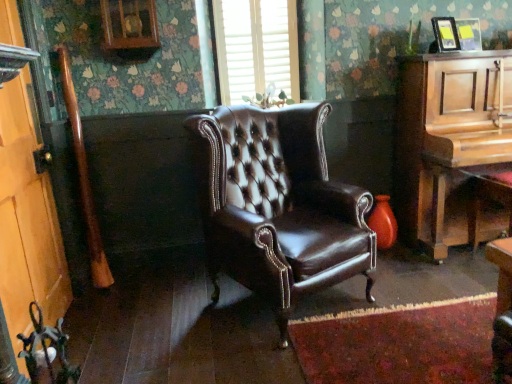
Question: Considering the positions of wooden door at left and wooden piano at right in the image, is wooden door at left wider or thinner than wooden piano at right?

Choices:
 (A) thin
 (B) wide

Answer: (A)

Question: From the image's perspective, relative to wooden piano at right, is wooden door at left above or below?

Choices:
 (A) above
 (B) below

Answer: (B)

Question: Estimate the real-world distances between objects in this image. Which object is closer to the white textured blinds at upper center?

Choices:
 (A) wooden piano at right
 (B) wooden door at left
 (C) brown leather wingback chair at center

Answer: (C)

Question: Which of these objects is positioned closest to the wooden door at left?

Choices:
 (A) wooden piano at right
 (B) white textured blinds at upper center
 (C) brown leather wingback chair at center

Answer: (C)